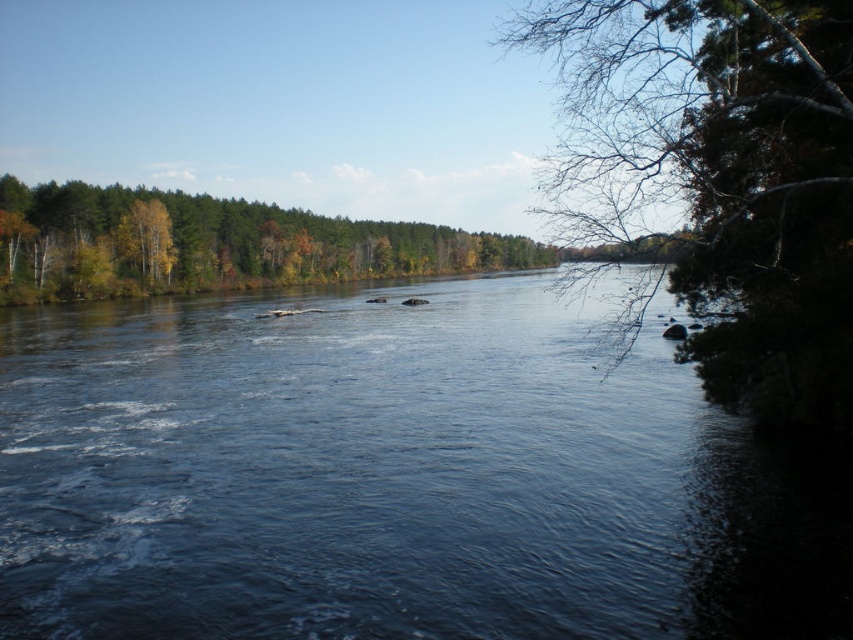
Does green leafy tree at right appear over green matte tree at upper left?

Correct, green leafy tree at right is located above green matte tree at upper left.

Is green leafy tree at right wider than green matte tree at upper left?

No.

Does point (796, 362) lie in front of point (64, 253)?

Yes.

At what (x,y) coordinates should I click in order to perform the action: click on green leafy tree at right. Please return your answer as a coordinate pair (x, y). Looking at the image, I should click on (724, 176).

Does green matte tree at upper left have a greater height compared to yellow-green leaves at left?

Correct, green matte tree at upper left is much taller as yellow-green leaves at left.

Between green matte tree at upper left and yellow-green leaves at left, which one has more height?

green matte tree at upper left is taller.

Who is more forward, (47, 282) or (135, 244)?

Point (47, 282)

The image size is (853, 640). Identify the location of green matte tree at upper left. (213, 244).

Between dark blue water at center and green matte tree at upper left, which one appears on the left side from the viewer's perspective?

From the viewer's perspective, green matte tree at upper left appears more on the left side.

Does point (410, 346) come in front of point (299, 225)?

Yes, it is.

This screenshot has height=640, width=853. In order to click on dark blue water at center in this screenshot , I will do `click(392, 477)`.